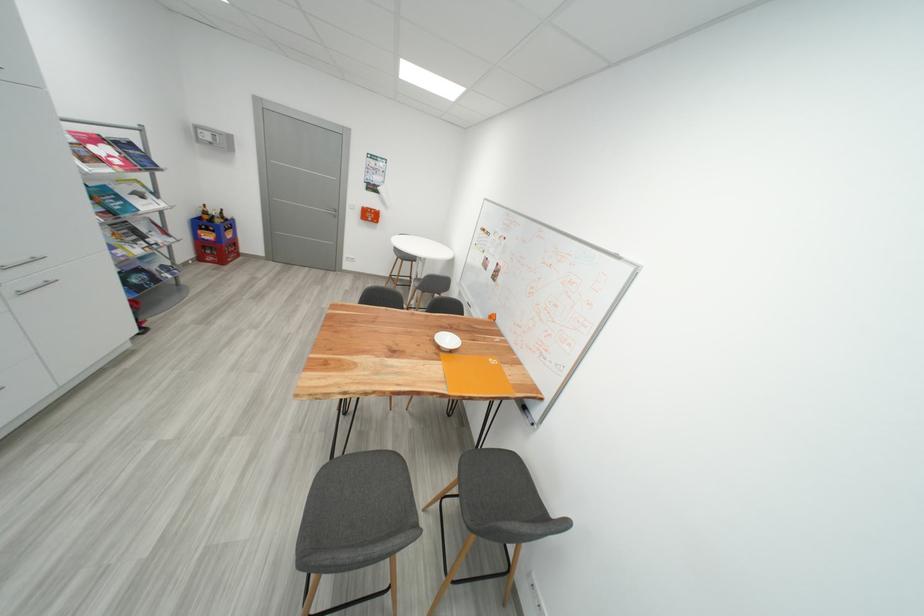
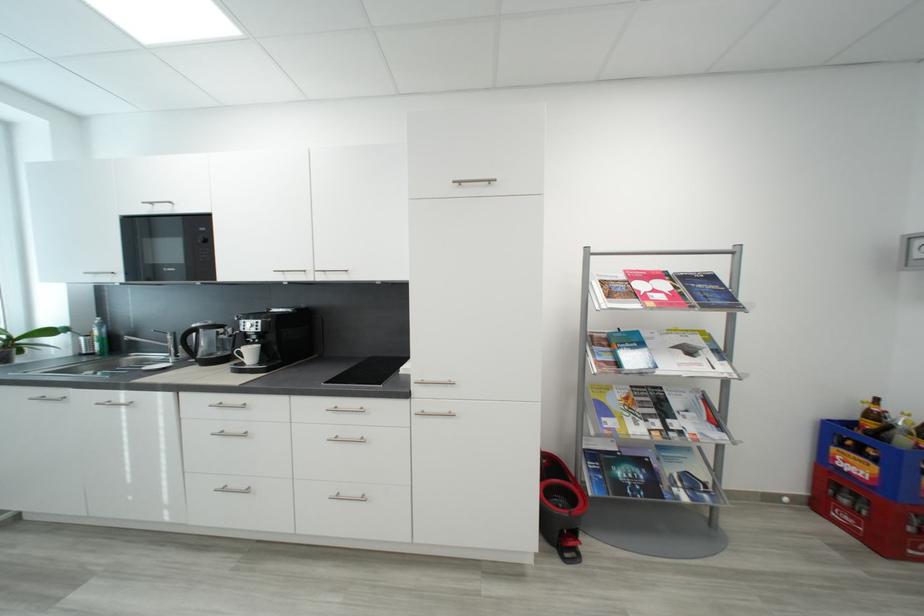
Find the pixel in the second image that matches (214,232) in the first image.

(867, 454)